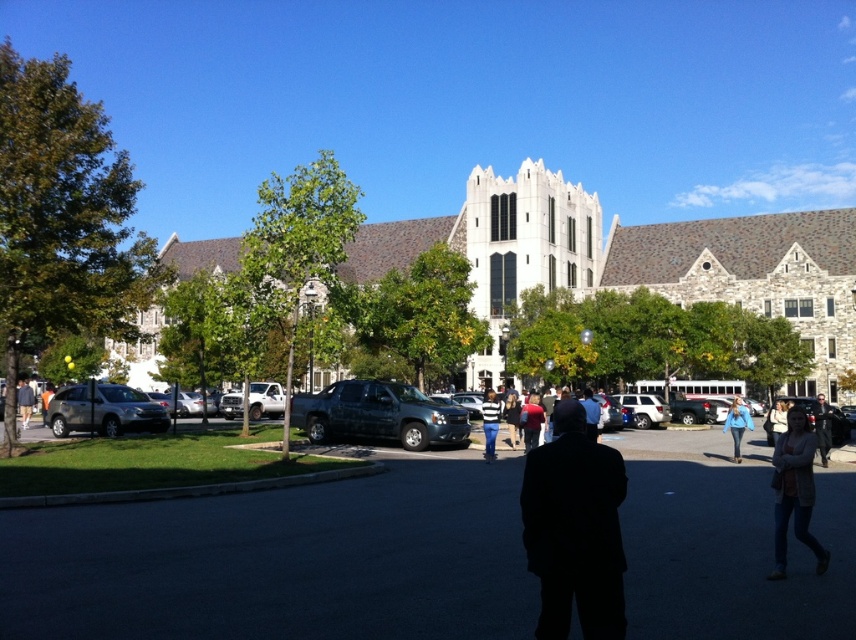
You are a delivery person needing to deliver a package to the white stone church at center. You are currently standing next to the satin silver suv at lower left. Can you walk directly to the church without crossing any roads or obstacles? The path is clear except for a small garden between them. The garden is 30 meters wide. What should you do?

The distance between the white stone church at center and the satin silver suv at lower left is 40.11 meters. Since the garden is only 30 meters wide, you can walk directly to the church without crossing any roads or obstacles as the remaining distance after the garden is 10.11 meters, which is clear.